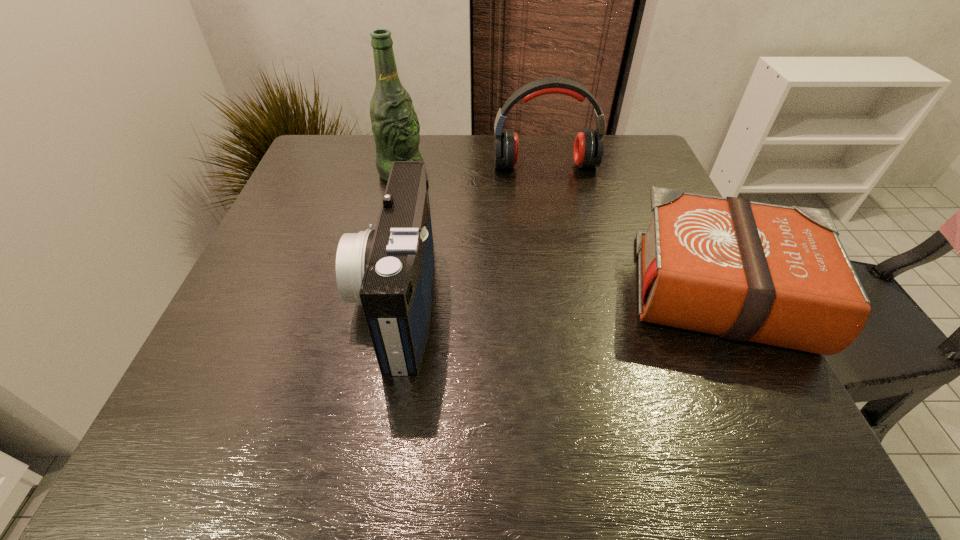
Identify the location of free spot between the shortest object and the camcorder. The width and height of the screenshot is (960, 540). point(558,295).

You are a GUI agent. You are given a task and a screenshot of the screen. Output one action in this format:
    pyautogui.click(x=<x>, y=<y>)
    Task: Click on the free space between the tallest object and the Bible
    The height and width of the screenshot is (540, 960).
    Given the screenshot: What is the action you would take?
    pyautogui.click(x=562, y=232)

The height and width of the screenshot is (540, 960). Find the location of `vacant region between the shortest object and the earphone`. vacant region between the shortest object and the earphone is located at coordinates (633, 228).

What are the coordinates of `vacant point located between the tallest object and the earphone` in the screenshot? It's located at (473, 169).

Locate an element on the screen. This screenshot has width=960, height=540. vacant space that's between the Bible and the beer bottle is located at coordinates (562, 232).

Identify the location of free space between the camcorder and the Bible. The width and height of the screenshot is (960, 540). (558, 295).

The width and height of the screenshot is (960, 540). Find the location of `vacant area that lies between the Bible and the camcorder`. vacant area that lies between the Bible and the camcorder is located at coordinates pos(558,295).

Locate an element on the screen. Image resolution: width=960 pixels, height=540 pixels. object that can be found as the third closest to the beer bottle is located at coordinates (747, 271).

Locate which object ranks in proximity to the shortest object. Please provide its 2D coordinates. Your answer should be formatted as a tuple, i.e. [(x, y)], where the tuple contains the x and y coordinates of a point satisfying the conditions above.

[(588, 148)]

You are a GUI agent. You are given a task and a screenshot of the screen. Output one action in this format:
    pyautogui.click(x=<x>, y=<y>)
    Task: Click on the free space that satisfies the following two spatial constraints: 1. on the front side of the beer bottle; 2. on the lens of the camcorder
    This screenshot has width=960, height=540.
    Given the screenshot: What is the action you would take?
    pyautogui.click(x=373, y=299)